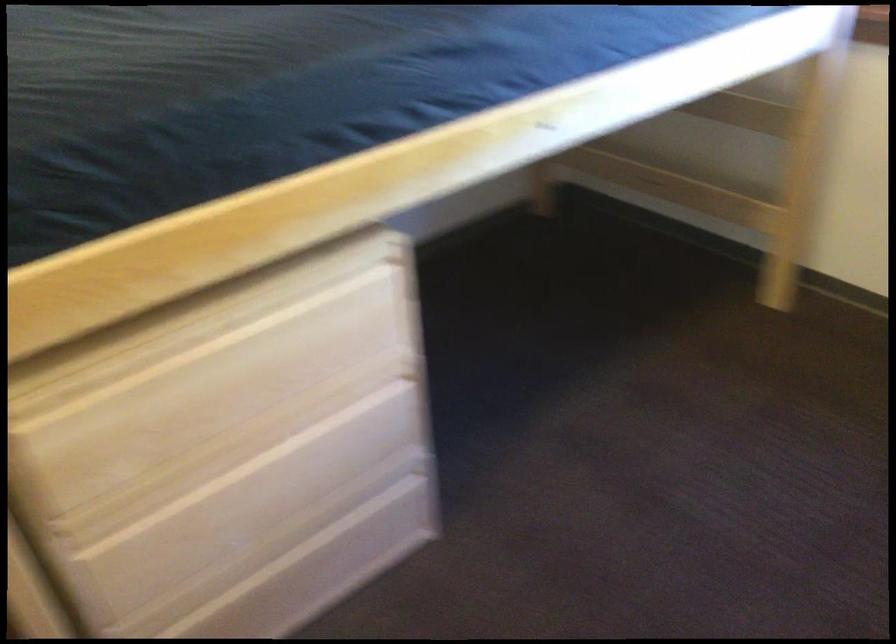
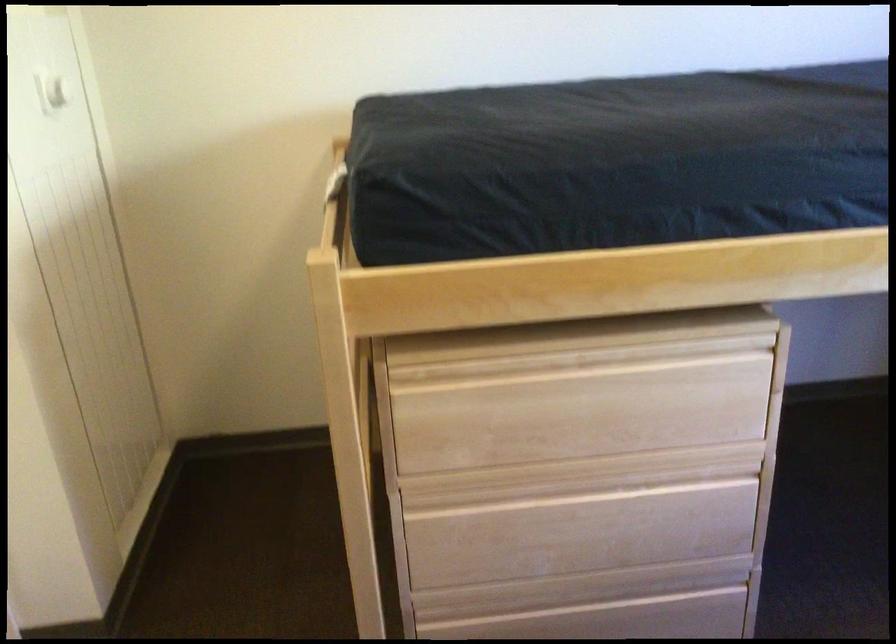
Find the pixel in the second image that matches (x=222, y=468) in the first image.

(546, 491)